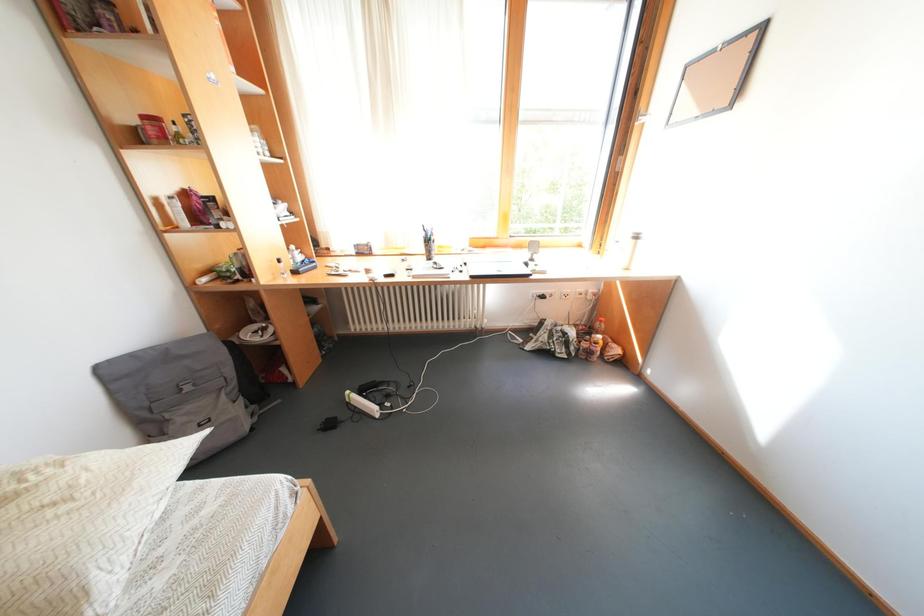
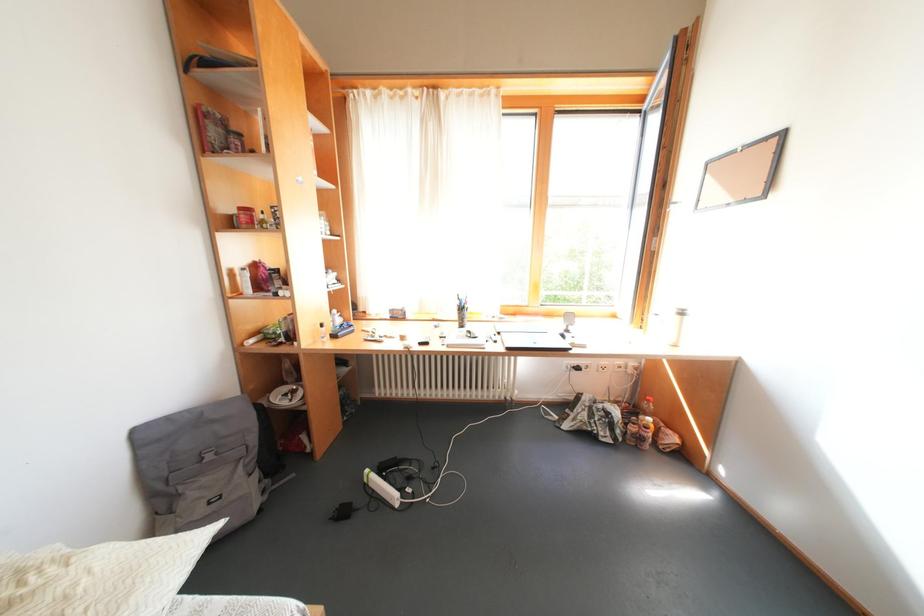
Question: What movement of the cameraman would produce the second image?

Choices:
 (A) Left
 (B) Right
 (C) Forward
 (D) Backward

Answer: (A)